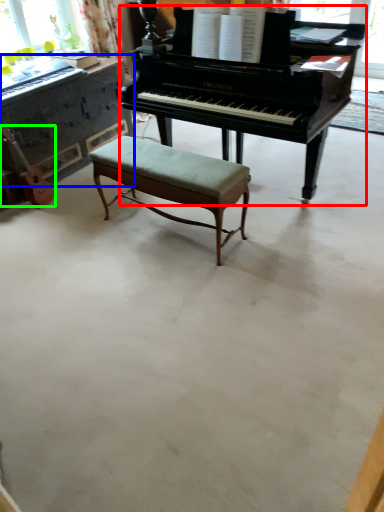
Question: Estimate the real-world distances between objects in this image. Which object is closer to piano (highlighted by a red box), piano (highlighted by a blue box) or guitar (highlighted by a green box)?

Choices:
 (A) piano
 (B) guitar

Answer: (A)